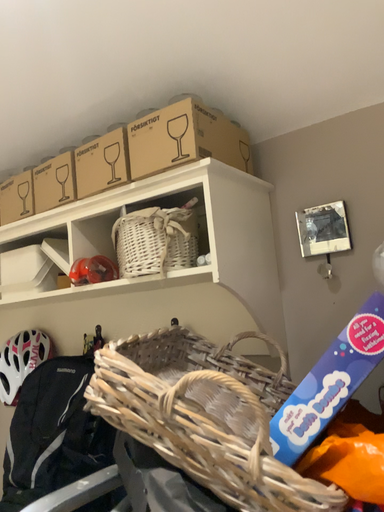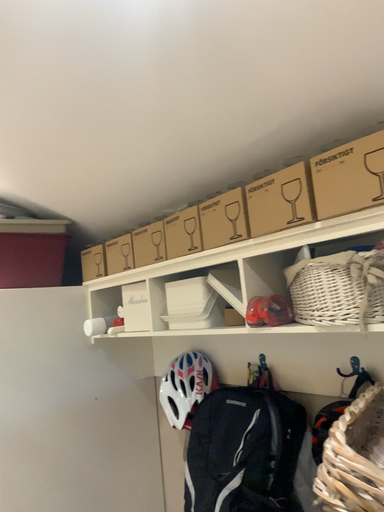
Question: Which way did the camera rotate in the video?

Choices:
 (A) rotated right
 (B) rotated left

Answer: (B)